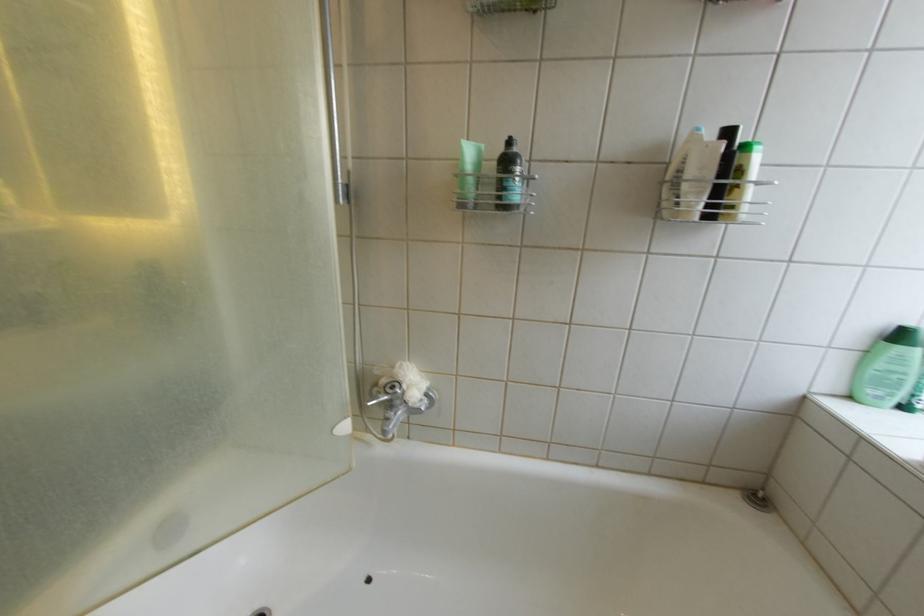
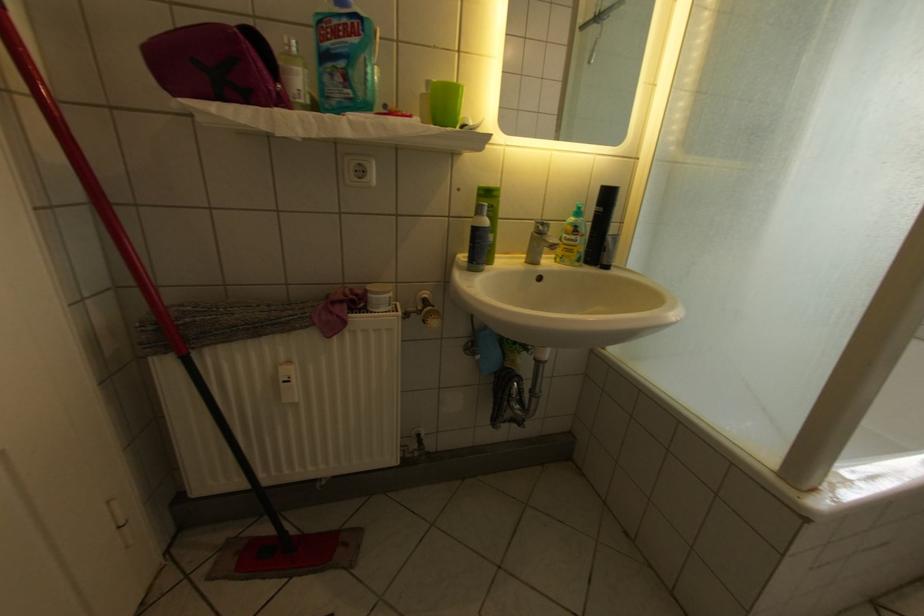
Question: The images are taken continuously from a first-person perspective. In which direction are you moving?

Choices:
 (A) Left
 (B) Right
 (C) Forward
 (D) Backward

Answer: (A)